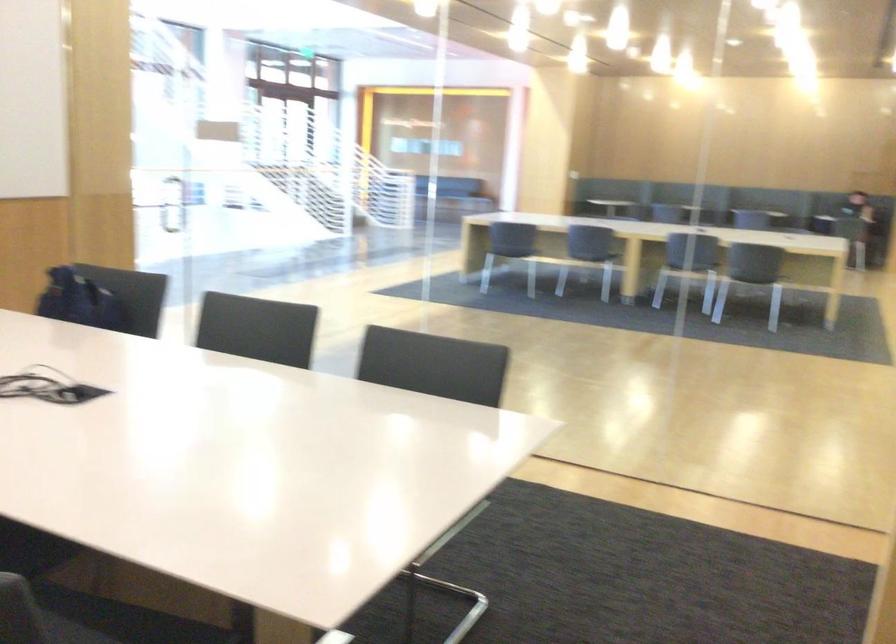
The image size is (896, 644). I want to click on grey chair sitting surface, so click(x=88, y=618).